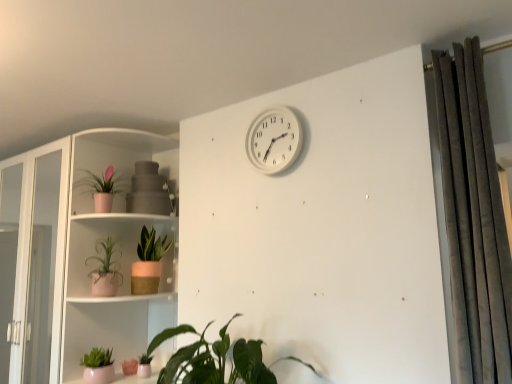
Question: Is matte pink pot at left, which is the 4th houseplant from front to back, with green matte plant pot at center-left, marked as the sixth houseplant in a front-to-back arrangement?

Choices:
 (A) yes
 (B) no

Answer: (B)

Question: From the image's perspective, is matte pink pot at left, which is the 4th houseplant from front to back, on top of green matte plant pot at center-left, the 1th houseplant in the back-to-front sequence?

Choices:
 (A) no
 (B) yes

Answer: (B)

Question: Is matte pink pot at left, which is the 4th houseplant from front to back, bigger than green matte plant pot at center-left, the 1th houseplant in the back-to-front sequence?

Choices:
 (A) yes
 (B) no

Answer: (B)

Question: Can you confirm if matte pink pot at left, which is the third houseplant in back-to-front order, is smaller than green matte plant pot at center-left, the 1th houseplant in the back-to-front sequence?

Choices:
 (A) yes
 (B) no

Answer: (A)

Question: Could you tell me if matte pink pot at left, which is the 4th houseplant from front to back, is turned towards green matte plant pot at center-left, the 1th houseplant in the back-to-front sequence?

Choices:
 (A) no
 (B) yes

Answer: (A)

Question: Considering the relative sizes of matte pink pot at left, which is the 4th houseplant from front to back, and green matte plant pot at center-left, the 1th houseplant in the back-to-front sequence, in the image provided, is matte pink pot at left, which is the 4th houseplant from front to back, taller than green matte plant pot at center-left, the 1th houseplant in the back-to-front sequence,?

Choices:
 (A) yes
 (B) no

Answer: (B)

Question: From a real-world perspective, is matte pink pot at left, the 4th houseplant in the back-to-front sequence, over pink matte pot at lower left, which is the 5th houseplant in front-to-back order?

Choices:
 (A) yes
 (B) no

Answer: (A)

Question: From the image's perspective, does matte pink pot at left, the 4th houseplant in the back-to-front sequence, appear higher than pink matte pot at lower left, the 2th houseplant viewed from the back?

Choices:
 (A) yes
 (B) no

Answer: (A)

Question: Is matte pink pot at left, the 4th houseplant in the back-to-front sequence, placed right next to pink matte pot at lower left, the 2th houseplant viewed from the back?

Choices:
 (A) yes
 (B) no

Answer: (B)

Question: Can you confirm if matte pink pot at left, the 4th houseplant in the back-to-front sequence, is thinner than pink matte pot at lower left, which is the 5th houseplant in front-to-back order?

Choices:
 (A) no
 (B) yes

Answer: (A)

Question: Is matte pink pot at left, the 4th houseplant in the back-to-front sequence, to the left of pink matte pot at lower left, the 2th houseplant viewed from the back, from the viewer's perspective?

Choices:
 (A) yes
 (B) no

Answer: (A)

Question: From the image's perspective, does matte pink pot at left, which is the 3th houseplant in front-to-back order, appear lower than pink matte pot at lower left, which is the 5th houseplant in front-to-back order?

Choices:
 (A) yes
 (B) no

Answer: (B)

Question: From a real-world perspective, is dark gray velvet curtain at right on white plastic wall clock at upper center?

Choices:
 (A) no
 (B) yes

Answer: (A)